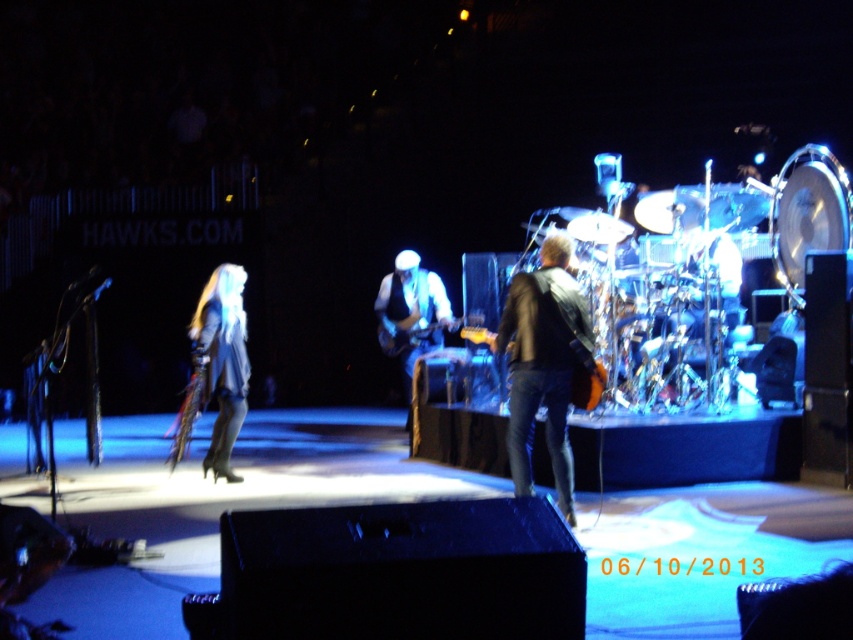
You are a photographer at the back of the stage. You want to take a photo of the shiny silver drum at right and the shiny black guitar at center. Which one should you pan your camera to the right from first?

The shiny silver drum at right is to the right of the shiny black guitar at center, so you should pan your camera to the right from the shiny black guitar at center first to capture the shiny silver drum at right.

What object is located at the point with coordinates (543, 364) in the image?

The point at coordinates (543, 364) is on the leather jacket at center.

You are a stagehand setting up equipment. You need to place a new microphone stand that requires 1 meter of space. You have space between the shiny silver drum at right and the shiny black guitar at center. Is there enough space for the stand?

The shiny silver drum at right is wider than the shiny black guitar at center. Therefore, the space between them may be sufficient for the microphone stand requiring 1 meter, but the exact distance isn